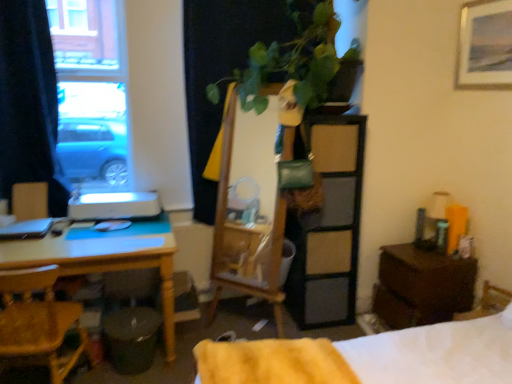
Question: Should I look upward or downward to see wooden framed painting at upper right?

Choices:
 (A) up
 (B) down

Answer: (A)

Question: From a real-world perspective, is yellow wood chair at lower left located higher than yellow fluffy blanket at lower center?

Choices:
 (A) no
 (B) yes

Answer: (A)

Question: Is yellow wood chair at lower left far from yellow fluffy blanket at lower center?

Choices:
 (A) no
 (B) yes

Answer: (A)

Question: Does yellow wood chair at lower left have a lesser width compared to yellow fluffy blanket at lower center?

Choices:
 (A) yes
 (B) no

Answer: (A)

Question: Is yellow wood chair at lower left further to the viewer compared to yellow fluffy blanket at lower center?

Choices:
 (A) yes
 (B) no

Answer: (A)

Question: Is yellow wood chair at lower left directly adjacent to yellow fluffy blanket at lower center?

Choices:
 (A) no
 (B) yes

Answer: (A)

Question: From a real-world perspective, is yellow wood chair at lower left located beneath yellow fluffy blanket at lower center?

Choices:
 (A) no
 (B) yes

Answer: (B)

Question: Is yellow fluffy blanket at lower center not close to white soft bed at lower right?

Choices:
 (A) yes
 (B) no

Answer: (B)

Question: Considering the relative positions of yellow fluffy blanket at lower center and white soft bed at lower right in the image provided, is yellow fluffy blanket at lower center in front of white soft bed at lower right?

Choices:
 (A) no
 (B) yes

Answer: (A)

Question: Is white soft bed at lower right at the back of yellow fluffy blanket at lower center?

Choices:
 (A) yes
 (B) no

Answer: (A)

Question: From the image's perspective, is yellow fluffy blanket at lower center under white soft bed at lower right?

Choices:
 (A) yes
 (B) no

Answer: (B)

Question: Could you tell me if yellow fluffy blanket at lower center is turned towards white soft bed at lower right?

Choices:
 (A) no
 (B) yes

Answer: (B)

Question: Is yellow fluffy blanket at lower center at the right side of white soft bed at lower right?

Choices:
 (A) no
 (B) yes

Answer: (A)

Question: Does matte wood armchair at left have a smaller size compared to yellow wood chair at lower left?

Choices:
 (A) yes
 (B) no

Answer: (A)